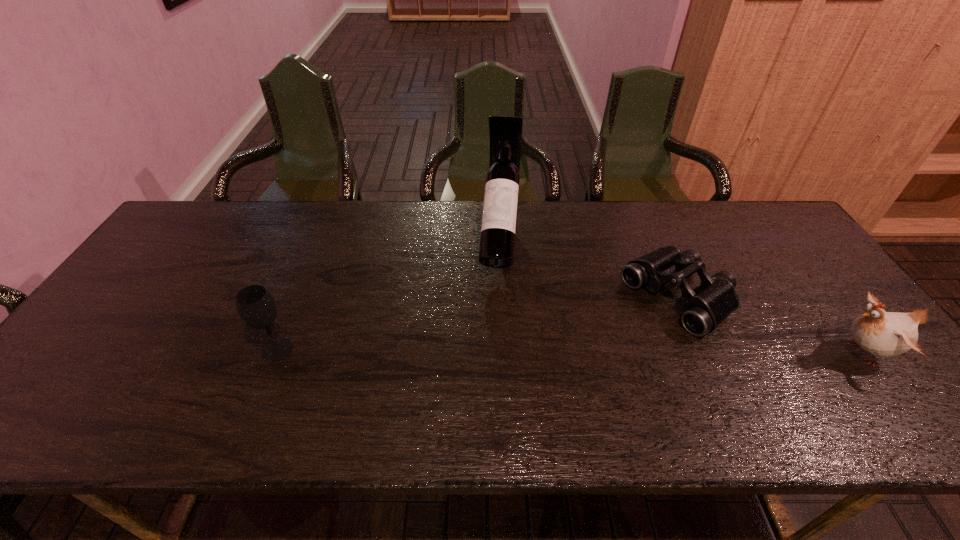
At what (x,y) coordinates should I click in order to perform the action: click on vacant position located 0.310m on the stand of the second object from left to right. Please return your answer as a coordinate pair (x, y). The width and height of the screenshot is (960, 540). Looking at the image, I should click on (489, 382).

What are the coordinates of `free space located on the stand of the second object from left to right` in the screenshot? It's located at (491, 363).

Find the location of a particular element. The width and height of the screenshot is (960, 540). free region located on the stand of the second object from left to right is located at coordinates (489, 386).

Image resolution: width=960 pixels, height=540 pixels. I want to click on vacant space situated 0.170m on the front-facing side of the shortest object, so click(595, 353).

Find the location of a particular element. Image resolution: width=960 pixels, height=540 pixels. free space located 0.080m on the front-facing side of the shortest object is located at coordinates (621, 336).

At what (x,y) coordinates should I click in order to perform the action: click on free region located 0.320m on the front-facing side of the shortest object. Please return your answer as a coordinate pair (x, y). Looking at the image, I should click on (547, 383).

Where is `object present at the far edge`? object present at the far edge is located at coordinates (498, 230).

Locate an element on the screen. object present at the near edge is located at coordinates [x=884, y=334].

Locate an element on the screen. This screenshot has height=540, width=960. object present at the right edge is located at coordinates (884, 334).

Locate an element on the screen. This screenshot has height=540, width=960. object positioned at the near right corner is located at coordinates (884, 334).